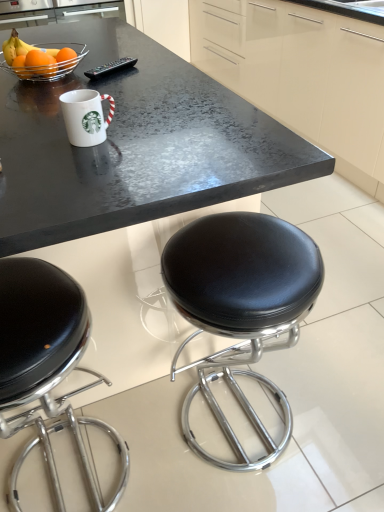
Locate an element on the screen. vacant area on the back side of white glossy mug at upper center is located at coordinates [129, 106].